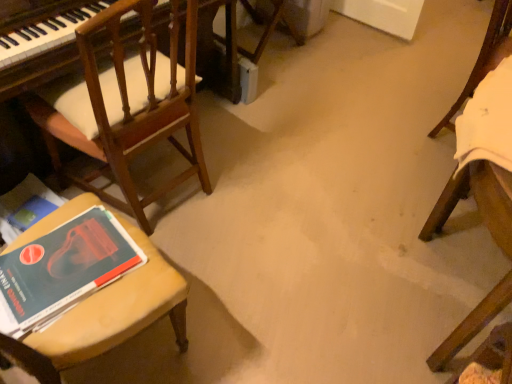
The image size is (512, 384). I want to click on unoccupied space behind white fabric chair at right, arranged as the 1th chair when viewed from the right, so click(x=418, y=88).